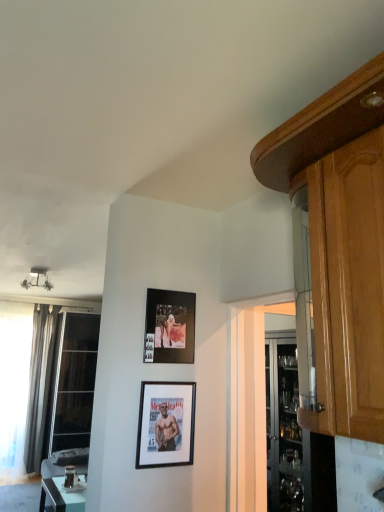
Question: Is silky gray curtain at left taller or shorter than matte black photo frame at upper center, the 1th picture frame from the top?

Choices:
 (A) short
 (B) tall

Answer: (B)

Question: Would you say silky gray curtain at left is to the left or to the right of matte black photo frame at upper center, positioned as the 2th picture frame in bottom-to-top order, in the picture?

Choices:
 (A) left
 (B) right

Answer: (A)

Question: Considering the real-world distances, which object is closest to the matte black photo frame at upper center, the 1th picture frame from the top?

Choices:
 (A) white glossy table at lower left
 (B) silky gray curtain at left
 (C) white sheer curtain at left, placed as the 2th window when sorted from right to left
 (D) transparent glass window at left, which ranks as the 2th window in left-to-right order
 (E) black matte picture frame at center, positioned as the second picture frame in top-to-bottom order

Answer: (E)

Question: Which is nearer to the white glossy table at lower left?

Choices:
 (A) silky gray curtain at left
 (B) matte black photo frame at upper center, positioned as the 2th picture frame in bottom-to-top order
 (C) transparent glass window at left, the 1th window from the right
 (D) black matte picture frame at center, positioned as the second picture frame in top-to-bottom order
 (E) white sheer curtain at left, placed as the 2th window when sorted from right to left

Answer: (C)